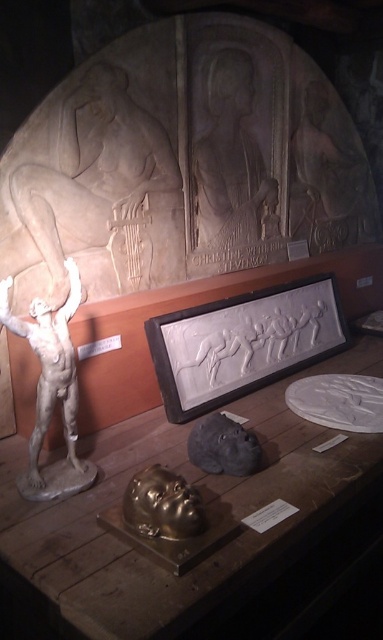
Question: Estimate the real-world distances between objects in this image. Which object is farther from the white marble statue at left?

Choices:
 (A) matte stone relief at center
 (B) wooden table at center

Answer: (A)

Question: Which point is closer to the camera?

Choices:
 (A) wooden table at center
 (B) white marble statue at left

Answer: (A)

Question: Can you confirm if wooden table at center is smaller than light beige stone relief at upper center?

Choices:
 (A) yes
 (B) no

Answer: (B)

Question: Can you confirm if light beige stone relief at upper center is positioned to the left of white marble statue at left?

Choices:
 (A) yes
 (B) no

Answer: (B)

Question: Does light beige stone relief at upper center have a lesser width compared to white marble statue at left?

Choices:
 (A) yes
 (B) no

Answer: (B)

Question: Based on their relative distances, which object is nearer to the matte stone relief at center?

Choices:
 (A) light beige stone relief at upper center
 (B) wooden table at center
 (C) white marble statue at left

Answer: (A)